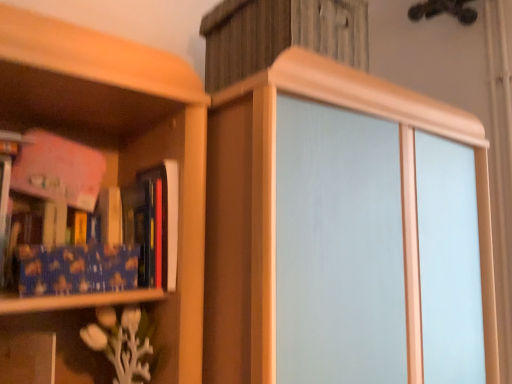
Question: Are blue textured fabric book at left, the 2th book viewed from the right, and hardcover book at left, arranged as the first book when viewed from the right, far apart?

Choices:
 (A) yes
 (B) no

Answer: (B)

Question: Considering the relative positions of blue textured fabric book at left, arranged as the 1th book when viewed from the left, and hardcover book at left, arranged as the first book when viewed from the right, in the image provided, is blue textured fabric book at left, arranged as the 1th book when viewed from the left, in front of hardcover book at left, arranged as the first book when viewed from the right,?

Choices:
 (A) no
 (B) yes

Answer: (B)

Question: From the image's perspective, does blue textured fabric book at left, arranged as the 1th book when viewed from the left, appear lower than hardcover book at left, positioned as the second book in left-to-right order?

Choices:
 (A) yes
 (B) no

Answer: (B)

Question: From a real-world perspective, is blue textured fabric book at left, arranged as the 1th book when viewed from the left, on hardcover book at left, arranged as the first book when viewed from the right?

Choices:
 (A) yes
 (B) no

Answer: (A)

Question: Considering the relative positions of blue textured fabric book at left, arranged as the 1th book when viewed from the left, and hardcover book at left, positioned as the second book in left-to-right order, in the image provided, is blue textured fabric book at left, arranged as the 1th book when viewed from the left, to the right of hardcover book at left, positioned as the second book in left-to-right order, from the viewer's perspective?

Choices:
 (A) no
 (B) yes

Answer: (A)

Question: Considering the relative positions of blue textured paper at left and blue textured fabric book at left, arranged as the 1th book when viewed from the left, in the image provided, is blue textured paper at left to the left or to the right of blue textured fabric book at left, arranged as the 1th book when viewed from the left,?

Choices:
 (A) left
 (B) right

Answer: (B)

Question: Relative to blue textured fabric book at left, the 2th book viewed from the right, is blue textured paper at left in front or behind?

Choices:
 (A) behind
 (B) front

Answer: (B)

Question: Is point (59, 249) closer or farther from the camera than point (116, 246)?

Choices:
 (A) farther
 (B) closer

Answer: (B)

Question: Is blue textured paper at left bigger or smaller than blue textured fabric book at left, the 2th book viewed from the right?

Choices:
 (A) big
 (B) small

Answer: (B)

Question: Considering the positions of white matte vase at lower left and blue textured fabric book at left, the 2th book viewed from the right, in the image, is white matte vase at lower left taller or shorter than blue textured fabric book at left, the 2th book viewed from the right,?

Choices:
 (A) short
 (B) tall

Answer: (A)

Question: From the image's perspective, relative to blue textured fabric book at left, the 2th book viewed from the right, is white matte vase at lower left above or below?

Choices:
 (A) below
 (B) above

Answer: (A)

Question: Is point (94, 327) positioned closer to the camera than point (46, 155)?

Choices:
 (A) closer
 (B) farther

Answer: (A)

Question: Is white matte vase at lower left inside the boundaries of blue textured fabric book at left, the 2th book viewed from the right, or outside?

Choices:
 (A) inside
 (B) outside

Answer: (B)

Question: Considering the positions of point (93, 340) and point (23, 292), is point (93, 340) closer or farther from the camera than point (23, 292)?

Choices:
 (A) farther
 (B) closer

Answer: (A)

Question: From a real-world perspective, relative to blue textured paper at left, is white matte vase at lower left vertically above or below?

Choices:
 (A) below
 (B) above

Answer: (A)